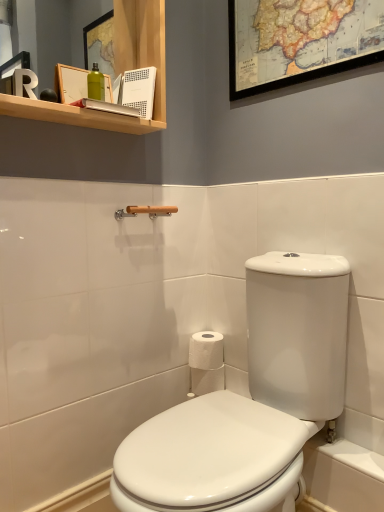
Question: Can wooden towel bar at upper center be found inside wooden map at upper center?

Choices:
 (A) yes
 (B) no

Answer: (B)

Question: From the image's perspective, is wooden map at upper center located above wooden towel bar at upper center?

Choices:
 (A) yes
 (B) no

Answer: (A)

Question: Are wooden map at upper center and wooden towel bar at upper center making contact?

Choices:
 (A) no
 (B) yes

Answer: (A)

Question: Is wooden map at upper center far from wooden towel bar at upper center?

Choices:
 (A) no
 (B) yes

Answer: (A)

Question: Does wooden map at upper center have a larger size compared to wooden towel bar at upper center?

Choices:
 (A) no
 (B) yes

Answer: (B)

Question: Considering the relative sizes of wooden map at upper center and wooden towel bar at upper center in the image provided, is wooden map at upper center thinner than wooden towel bar at upper center?

Choices:
 (A) no
 (B) yes

Answer: (B)

Question: From the image's perspective, would you say wooden shelf at upper left is shown under white glossy toilet at center?

Choices:
 (A) no
 (B) yes

Answer: (A)

Question: From a real-world perspective, is wooden shelf at upper left positioned under white glossy toilet at center based on gravity?

Choices:
 (A) no
 (B) yes

Answer: (A)

Question: Does wooden shelf at upper left lie behind white glossy toilet at center?

Choices:
 (A) yes
 (B) no

Answer: (A)

Question: Does wooden shelf at upper left have a smaller size compared to white glossy toilet at center?

Choices:
 (A) no
 (B) yes

Answer: (B)

Question: Can you confirm if wooden shelf at upper left is wider than white glossy toilet at center?

Choices:
 (A) no
 (B) yes

Answer: (A)

Question: Does wooden shelf at upper left have a lesser width compared to white glossy toilet at center?

Choices:
 (A) yes
 (B) no

Answer: (A)

Question: Could you tell me if white glossy toilet at center is facing white paper at center?

Choices:
 (A) no
 (B) yes

Answer: (A)